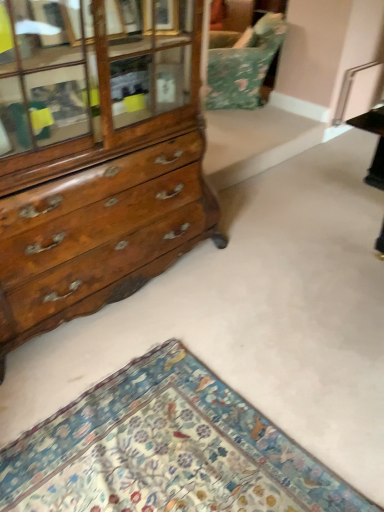
Locate an element on the screen. floral fabric swivel chair at upper center is located at coordinates (242, 63).

Locate an element on the screen. The height and width of the screenshot is (512, 384). wooden chest of drawers at left is located at coordinates (109, 185).

Would you say floral fabric swivel chair at upper center is to the left or to the right of wooden chest of drawers at left in the picture?

Clearly, floral fabric swivel chair at upper center is on the right of wooden chest of drawers at left in the image.

Is floral fabric swivel chair at upper center facing away from wooden chest of drawers at left?

No.

Which of these two, floral fabric swivel chair at upper center or wooden chest of drawers at left, stands taller?

Standing taller between the two is wooden chest of drawers at left.

Is floral fabric swivel chair at upper center wider than wooden chest of drawers at left?

Correct, the width of floral fabric swivel chair at upper center exceeds that of wooden chest of drawers at left.

From the image's perspective, is wooden chest of drawers at left located above floral carpet at lower left?

Indeed, from the image's perspective, wooden chest of drawers at left is shown above floral carpet at lower left.

Is wooden chest of drawers at left positioned beyond the bounds of floral carpet at lower left?

Yes, wooden chest of drawers at left is located beyond the bounds of floral carpet at lower left.

In the scene shown: Considering the relative sizes of wooden chest of drawers at left and floral carpet at lower left in the image provided, is wooden chest of drawers at left bigger than floral carpet at lower left?

Yes, wooden chest of drawers at left is bigger than floral carpet at lower left.

Is the surface of wooden chest of drawers at left in direct contact with floral carpet at lower left?

wooden chest of drawers at left and floral carpet at lower left are clearly separated.

From the image's perspective, between floral carpet at lower left and floral fabric swivel chair at upper center, who is located below?

floral carpet at lower left.

Is there a large distance between floral carpet at lower left and floral fabric swivel chair at upper center?

floral carpet at lower left is far away from floral fabric swivel chair at upper center.

Is floral carpet at lower left to the left of floral fabric swivel chair at upper center from the viewer's perspective?

Yes.

Can you tell me how much floral carpet at lower left and wooden chest of drawers at left differ in facing direction?

The angular difference between floral carpet at lower left and wooden chest of drawers at left is 91.7 degrees.

Is floral carpet at lower left next to wooden chest of drawers at left and touching it?

They are not placed beside each other.

Based on the photo, which is nearer, (x=255, y=496) or (x=152, y=3)?

Point (x=255, y=496) is closer to the camera than point (x=152, y=3).

Between floral carpet at lower left and wooden chest of drawers at left, which one has larger width?

floral carpet at lower left.

Would you say wooden chest of drawers at left is to the left or to the right of floral fabric swivel chair at upper center in the picture?

Clearly, wooden chest of drawers at left is on the left of floral fabric swivel chair at upper center in the image.

From the image's perspective, which one is positioned lower, wooden chest of drawers at left or floral fabric swivel chair at upper center?

wooden chest of drawers at left, from the image's perspective.

Which of these two, wooden chest of drawers at left or floral fabric swivel chair at upper center, is bigger?

Bigger between the two is wooden chest of drawers at left.

From a real-world perspective, does wooden chest of drawers at left sit lower than floral fabric swivel chair at upper center?

No, from a real-world perspective, wooden chest of drawers at left is not below floral fabric swivel chair at upper center.

Is point (221, 80) closer or farther from the camera than point (128, 409)?

Point (221, 80) appears to be farther away from the viewer than point (128, 409).

Is floral fabric swivel chair at upper center positioned with its back to floral carpet at lower left?

No.

From a real-world perspective, is floral fabric swivel chair at upper center positioned under floral carpet at lower left based on gravity?

No, from a real-world perspective, floral fabric swivel chair at upper center is not under floral carpet at lower left.

From their relative heights in the image, would you say floral fabric swivel chair at upper center is taller or shorter than floral carpet at lower left?

Clearly, floral fabric swivel chair at upper center is taller compared to floral carpet at lower left.

You are a GUI agent. You are given a task and a screenshot of the screen. Output one action in this format:
    pyautogui.click(x=<x>, y=<y>)
    Task: Click on the swivel chair that appears behind the wooden chest of drawers at left
    
    Given the screenshot: What is the action you would take?
    pyautogui.click(x=242, y=63)

The width and height of the screenshot is (384, 512). Find the location of `mat lying in front of the wooden chest of drawers at left`. mat lying in front of the wooden chest of drawers at left is located at coordinates (166, 450).

From the image, which object appears to be nearer to floral fabric swivel chair at upper center, wooden chest of drawers at left or floral carpet at lower left?

The object closer to floral fabric swivel chair at upper center is wooden chest of drawers at left.

Based on their spatial positions, is floral fabric swivel chair at upper center or wooden chest of drawers at left closer to floral carpet at lower left?

wooden chest of drawers at left is closer to floral carpet at lower left.

From the image, which object appears to be nearer to wooden chest of drawers at left, floral carpet at lower left or floral fabric swivel chair at upper center?

floral carpet at lower left is closer to wooden chest of drawers at left.

Looking at the image, which one is located closer to floral fabric swivel chair at upper center, floral carpet at lower left or wooden chest of drawers at left?

Among the two, wooden chest of drawers at left is located nearer to floral fabric swivel chair at upper center.

When comparing their distances from floral carpet at lower left, does wooden chest of drawers at left or floral fabric swivel chair at upper center seem closer?

The object closer to floral carpet at lower left is wooden chest of drawers at left.

Looking at the image, which one is located closer to wooden chest of drawers at left, floral fabric swivel chair at upper center or floral carpet at lower left?

Among the two, floral carpet at lower left is located nearer to wooden chest of drawers at left.

Locate an element on the screen. the chest of drawers positioned between floral carpet at lower left and floral fabric swivel chair at upper center from near to far is located at coordinates (109, 185).